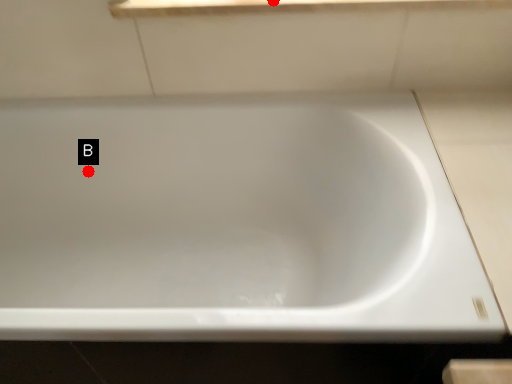
Question: Two points are circled on the image, labeled by A and B beside each circle. Which point appears closest to the camera in this image?

Choices:
 (A) A is closer
 (B) B is closer

Answer: (A)